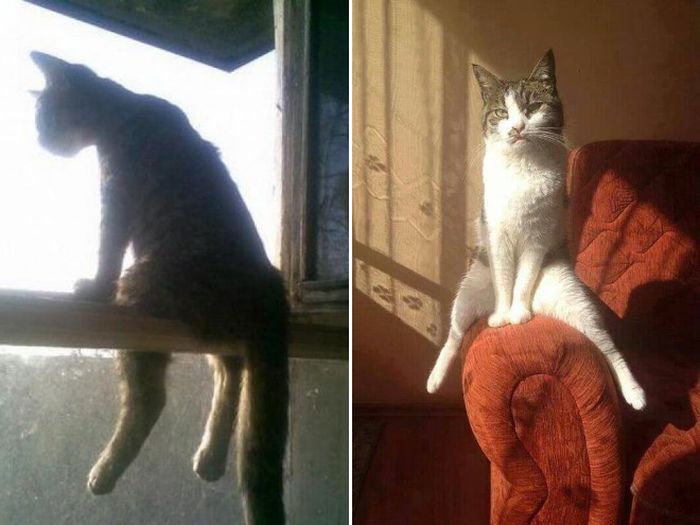
You are a GUI agent. You are given a task and a screenshot of the screen. Output one action in this format:
    pyautogui.click(x=<x>, y=<y>)
    Task: Click on the white border between pictures
    
    Given the screenshot: What is the action you would take?
    (x=350, y=184), (x=349, y=455)